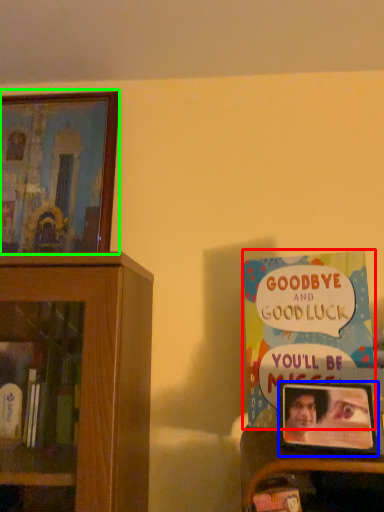
Question: Which object is positioned farthest from book (highlighted by a red box)? Select from picture frame (highlighted by a blue box) and picture frame (highlighted by a green box).

Choices:
 (A) picture frame
 (B) picture frame

Answer: (B)